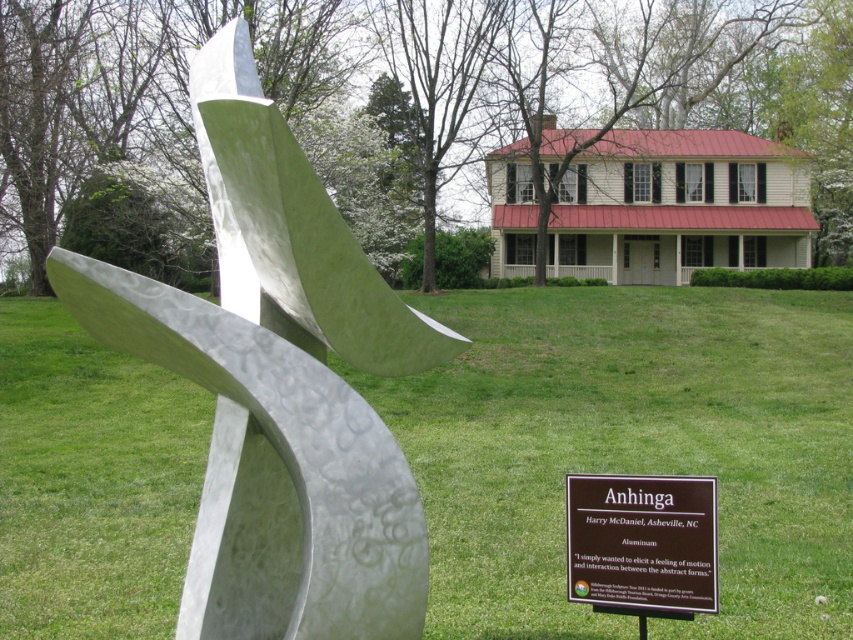
Does point (22, 531) come farther from viewer compared to point (677, 557)?

That is True.

Is green grass at lower center shorter than brown aluminum sign at center?

In fact, green grass at lower center may be taller than brown aluminum sign at center.

This screenshot has height=640, width=853. What are the coordinates of `green grass at lower center` in the screenshot? It's located at coord(631,448).

Does polished aluminum sculpture at center have a lesser height compared to brown aluminum sign at center?

No, polished aluminum sculpture at center is not shorter than brown aluminum sign at center.

Which is in front, point (196, 301) or point (683, 490)?

Point (196, 301)

Is point (254, 275) farther from camera compared to point (572, 589)?

No, (254, 275) is in front of (572, 589).

Where is `polished aluminum sculpture at center`? polished aluminum sculpture at center is located at coordinates (279, 385).

Between green grass at lower center and polished aluminum sculpture at center, which one is positioned higher?

polished aluminum sculpture at center is higher up.

Is green grass at lower center to the left of polished aluminum sculpture at center from the viewer's perspective?

Correct, you'll find green grass at lower center to the left of polished aluminum sculpture at center.

What are the coordinates of `green grass at lower center` in the screenshot? It's located at click(x=631, y=448).